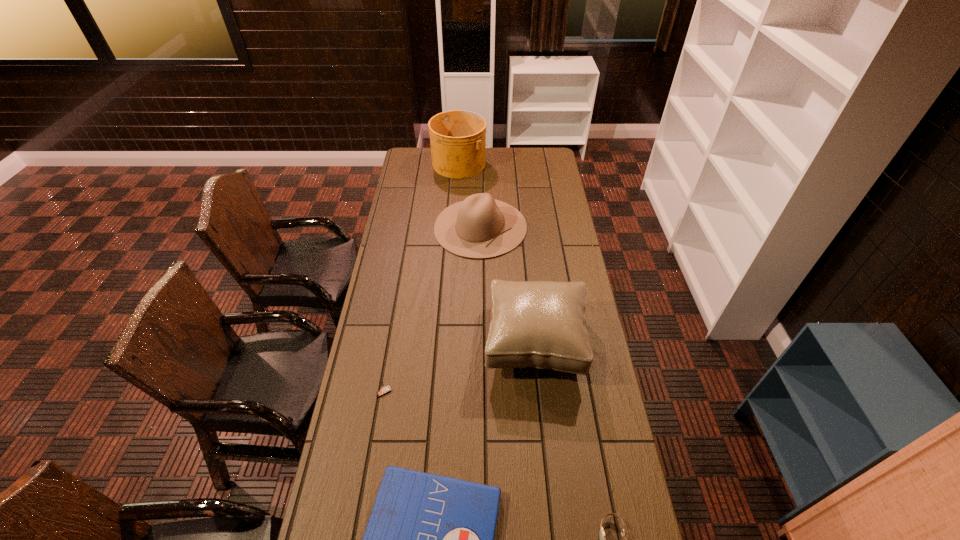
Locate an element on the screen. bucket positioned at the left edge is located at coordinates click(x=457, y=137).

The height and width of the screenshot is (540, 960). Identify the location of matchbox that is at the left edge. (384, 389).

The image size is (960, 540). I want to click on object that is at the right edge, so click(541, 324).

This screenshot has width=960, height=540. What are the coordinates of `object present at the far left corner` in the screenshot? It's located at 457,137.

Locate an element on the screen. The height and width of the screenshot is (540, 960). free region at the far edge is located at coordinates (502, 159).

Find the location of a particular element. This screenshot has height=540, width=960. blank area at the left edge is located at coordinates (394, 302).

In the image, there is a desktop. In order to click on vacant space at the right edge in this screenshot , I will do `click(622, 450)`.

In the image, there is a desktop. In order to click on vacant space at the far left corner in this screenshot , I will do `click(423, 163)`.

Locate an element on the screen. Image resolution: width=960 pixels, height=540 pixels. free region at the far right corner of the desktop is located at coordinates (555, 158).

Image resolution: width=960 pixels, height=540 pixels. Identify the location of vacant space that is in between the bucket and the third shortest object. (422, 278).